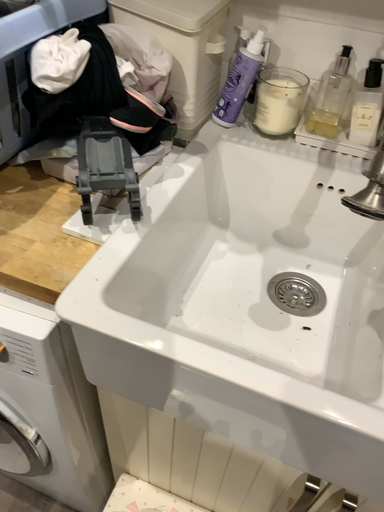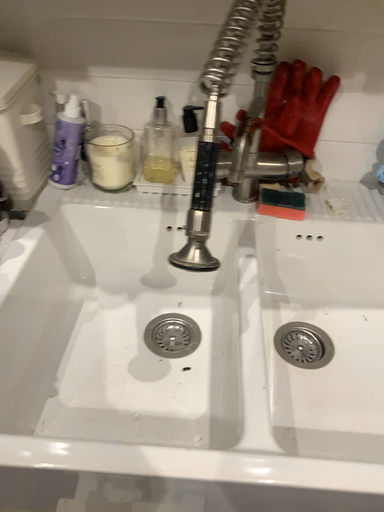
Question: How did the camera likely rotate when shooting the video?

Choices:
 (A) rotated right
 (B) rotated left

Answer: (A)